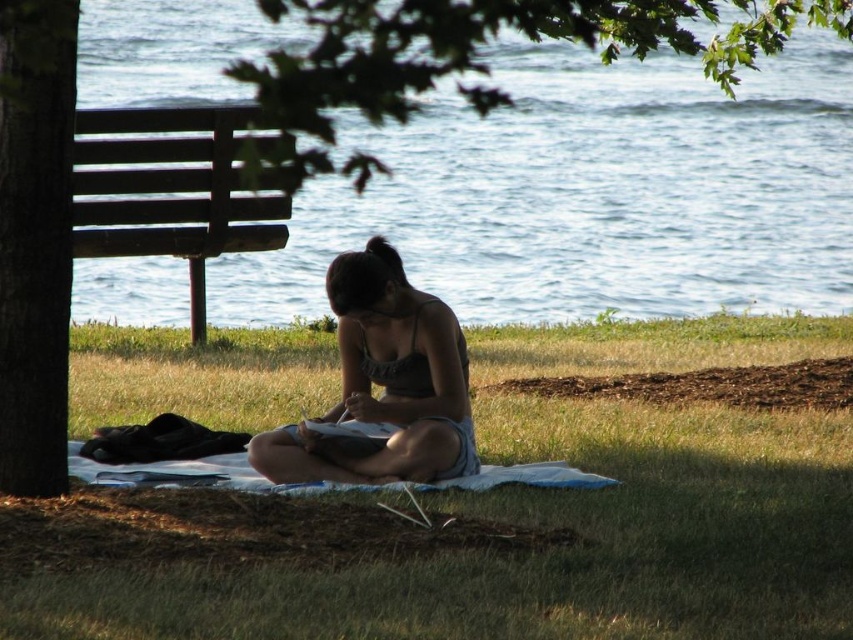
Between point (704, 88) and point (381, 280), which one is positioned in front?

Point (381, 280) is more forward.

From the picture: Measure the distance between blue water at center and camera.

blue water at center and camera are 4.30 meters apart from each other.

At what (x,y) coordinates should I click in order to perform the action: click on blue water at center. Please return your answer as a coordinate pair (x, y). Looking at the image, I should click on (590, 193).

Can you confirm if green grass at center is positioned to the right of matte black tank top at center?

In fact, green grass at center is to the left of matte black tank top at center.

Is point (637, 572) in front of point (399, 472)?

That is True.

Where is `green grass at center`? The height and width of the screenshot is (640, 853). green grass at center is located at coordinates (561, 518).

Is the position of green grass at center more distant than that of brown wooden bench at left?

That is False.

At what (x,y) coordinates should I click in order to perform the action: click on green grass at center. Please return your answer as a coordinate pair (x, y). The width and height of the screenshot is (853, 640). Looking at the image, I should click on [x=561, y=518].